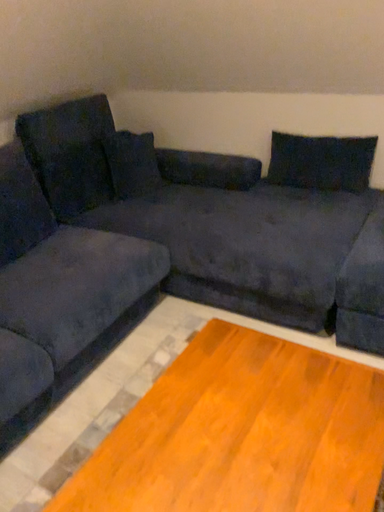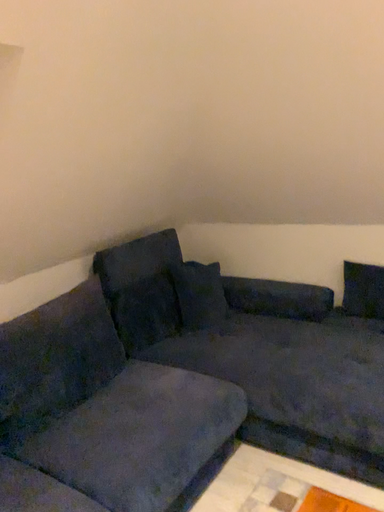
Question: How did the camera likely rotate when shooting the video?

Choices:
 (A) rotated downward
 (B) rotated upward

Answer: (B)